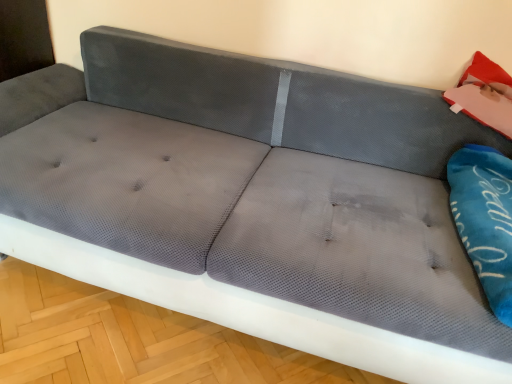
Describe the element at coordinates (484, 94) in the screenshot. I see `matte pink cushion at upper right` at that location.

You are a GUI agent. You are given a task and a screenshot of the screen. Output one action in this format:
    pyautogui.click(x=<x>, y=<y>)
    Task: Click on the matte pink cushion at upper right
    The height and width of the screenshot is (384, 512).
    Given the screenshot: What is the action you would take?
    pyautogui.click(x=484, y=94)

At what (x,y) coordinates should I click in order to perform the action: click on blue fabric pillow at right. Please return your answer as a coordinate pair (x, y). Looking at the image, I should click on (485, 219).

What do you see at coordinates (485, 219) in the screenshot? The height and width of the screenshot is (384, 512). I see `blue fabric pillow at right` at bounding box center [485, 219].

Image resolution: width=512 pixels, height=384 pixels. Find the location of `matte pink cushion at upper right`. matte pink cushion at upper right is located at coordinates (484, 94).

Considering the positions of objects matte pink cushion at upper right and blue fabric pillow at right in the image provided, who is more to the left, matte pink cushion at upper right or blue fabric pillow at right?

blue fabric pillow at right.

Is matte pink cushion at upper right closer to the viewer compared to blue fabric pillow at right?

No, it is behind blue fabric pillow at right.

Is point (490, 90) behind point (502, 245)?

Yes, it is behind point (502, 245).

From the image's perspective, which is above, matte pink cushion at upper right or blue fabric pillow at right?

matte pink cushion at upper right is shown above in the image.

From a real-world perspective, is matte pink cushion at upper right physically located above or below blue fabric pillow at right?

matte pink cushion at upper right is above blue fabric pillow at right.

Can you confirm if matte pink cushion at upper right is wider than blue fabric pillow at right?

In fact, matte pink cushion at upper right might be narrower than blue fabric pillow at right.

Considering the relative sizes of matte pink cushion at upper right and blue fabric pillow at right in the image provided, is matte pink cushion at upper right shorter than blue fabric pillow at right?

No, matte pink cushion at upper right is not shorter than blue fabric pillow at right.

Based on the photo, considering the sizes of matte pink cushion at upper right and blue fabric pillow at right in the image, is matte pink cushion at upper right bigger or smaller than blue fabric pillow at right?

matte pink cushion at upper right is smaller than blue fabric pillow at right.

Would you say matte pink cushion at upper right is inside or outside blue fabric pillow at right?

The correct answer is: outside.

Are matte pink cushion at upper right and blue fabric pillow at right far apart?

matte pink cushion at upper right is near blue fabric pillow at right, not far away.

Is matte pink cushion at upper right oriented away from blue fabric pillow at right?

That's not correct — matte pink cushion at upper right is not looking away from blue fabric pillow at right.

In the image, there is a blue fabric pillow at right. Identify the location of material above it (from the image's perspective). This screenshot has width=512, height=384. (484, 94).

Which is more to the right, blue fabric pillow at right or matte pink cushion at upper right?

Positioned to the right is matte pink cushion at upper right.

From the picture: Is blue fabric pillow at right in front of matte pink cushion at upper right?

Yes, the depth of blue fabric pillow at right is less than that of matte pink cushion at upper right.

Is point (482, 156) closer to viewer compared to point (479, 114)?

Yes, point (482, 156) is closer to viewer.

From the image's perspective, is blue fabric pillow at right beneath matte pink cushion at upper right?

Correct, blue fabric pillow at right appears lower than matte pink cushion at upper right in the image.

From a real-world perspective, which object stands above the other?

In real-world perspective, matte pink cushion at upper right is above.

Is blue fabric pillow at right thinner than matte pink cushion at upper right?

No, blue fabric pillow at right is not thinner than matte pink cushion at upper right.

Who is shorter, blue fabric pillow at right or matte pink cushion at upper right?

blue fabric pillow at right is shorter.

Is blue fabric pillow at right bigger than matte pink cushion at upper right?

Correct, blue fabric pillow at right is larger in size than matte pink cushion at upper right.

Would you say blue fabric pillow at right is inside or outside matte pink cushion at upper right?

The correct answer is: outside.

Does blue fabric pillow at right touch matte pink cushion at upper right?

No, blue fabric pillow at right is not with matte pink cushion at upper right.

Does blue fabric pillow at right turn towards matte pink cushion at upper right?

No.

How distant is blue fabric pillow at right from matte pink cushion at upper right?

blue fabric pillow at right is 11.36 inches away from matte pink cushion at upper right.

Image resolution: width=512 pixels, height=384 pixels. What are the coordinates of `pillow that is in front of the matte pink cushion at upper right` in the screenshot? It's located at pos(485,219).

There is a blue fabric pillow at right. Identify the location of material above it (from a real-world perspective). (484, 94).

Locate an element on the screen. The image size is (512, 384). material that is above the blue fabric pillow at right (from the image's perspective) is located at coordinates (484, 94).